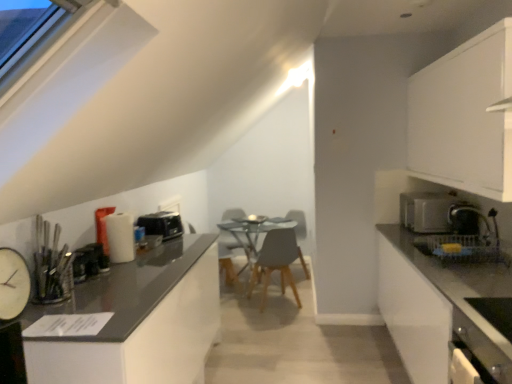
Question: Is white glossy countertop at right smaller than satin black toaster at right, the 3th appliance viewed from the front?

Choices:
 (A) yes
 (B) no

Answer: (B)

Question: Does white glossy countertop at right have a larger size compared to satin black toaster at right, which ranks as the second appliance in back-to-front order?

Choices:
 (A) no
 (B) yes

Answer: (B)

Question: Is white glossy countertop at right far away from satin black toaster at right, the 3th appliance viewed from the front?

Choices:
 (A) no
 (B) yes

Answer: (A)

Question: Can we say white glossy countertop at right lies outside satin black toaster at right, which ranks as the second appliance in back-to-front order?

Choices:
 (A) yes
 (B) no

Answer: (A)

Question: Is white glossy countertop at right looking in the opposite direction of satin black toaster at right, placed as the 1th appliance when sorted from right to left?

Choices:
 (A) yes
 (B) no

Answer: (B)

Question: Is white glossy countertop at right taller than satin black toaster at right, the 3th appliance viewed from the front?

Choices:
 (A) no
 (B) yes

Answer: (B)

Question: From a real-world perspective, is satin silver toaster at right located beneath white glossy dishwasher at lower right?

Choices:
 (A) no
 (B) yes

Answer: (A)

Question: Is satin silver toaster at right outside of white glossy dishwasher at lower right?

Choices:
 (A) no
 (B) yes

Answer: (B)

Question: From a real-world perspective, is satin silver toaster at right located higher than white glossy dishwasher at lower right?

Choices:
 (A) no
 (B) yes

Answer: (B)

Question: Would you consider satin silver toaster at right to be distant from white glossy dishwasher at lower right?

Choices:
 (A) yes
 (B) no

Answer: (A)

Question: Does satin silver toaster at right come behind white glossy dishwasher at lower right?

Choices:
 (A) no
 (B) yes

Answer: (B)

Question: Does satin silver toaster at right have a smaller size compared to white glossy dishwasher at lower right?

Choices:
 (A) no
 (B) yes

Answer: (A)

Question: From a real-world perspective, is white clock at left, the 4th appliance in the back-to-front sequence, beneath black plastic toaster at left, the third appliance in the left-to-right sequence?

Choices:
 (A) no
 (B) yes

Answer: (A)